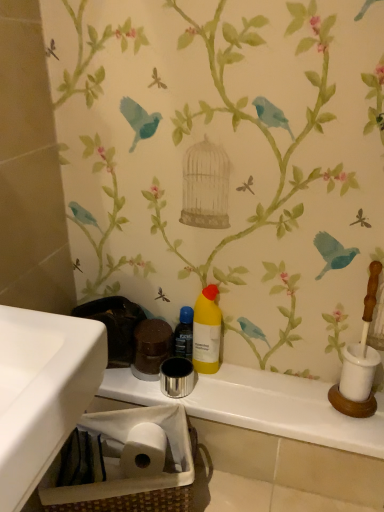
Where is `unoccupied region to the right of translucent plastic bottle at center`? The width and height of the screenshot is (384, 512). unoccupied region to the right of translucent plastic bottle at center is located at coordinates (252, 378).